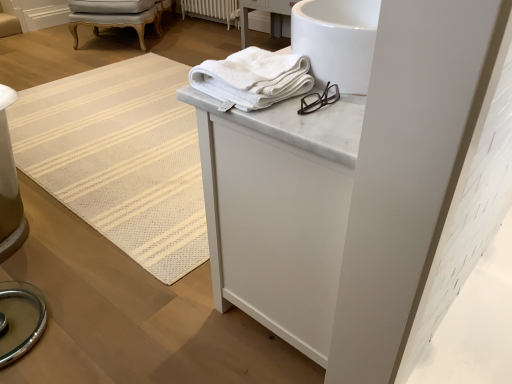
Question: From a real-world perspective, is light gray upholstered chair at upper left positioned above or below white marble cabinet at upper center?

Choices:
 (A) above
 (B) below

Answer: (B)

Question: From the image's perspective, is light gray upholstered chair at upper left positioned above or below white marble cabinet at upper center?

Choices:
 (A) below
 (B) above

Answer: (B)

Question: Which object is positioned closest to the white textured mat at upper center?

Choices:
 (A) white cotton towel at upper center
 (B) light gray upholstered chair at upper left
 (C) white marble cabinet at upper center
 (D) white painted radiator at center

Answer: (C)

Question: Estimate the real-world distances between objects in this image. Which object is farther from the white painted radiator at center?

Choices:
 (A) white marble cabinet at upper center
 (B) white cotton towel at upper center
 (C) light gray upholstered chair at upper left
 (D) white textured mat at upper center

Answer: (A)